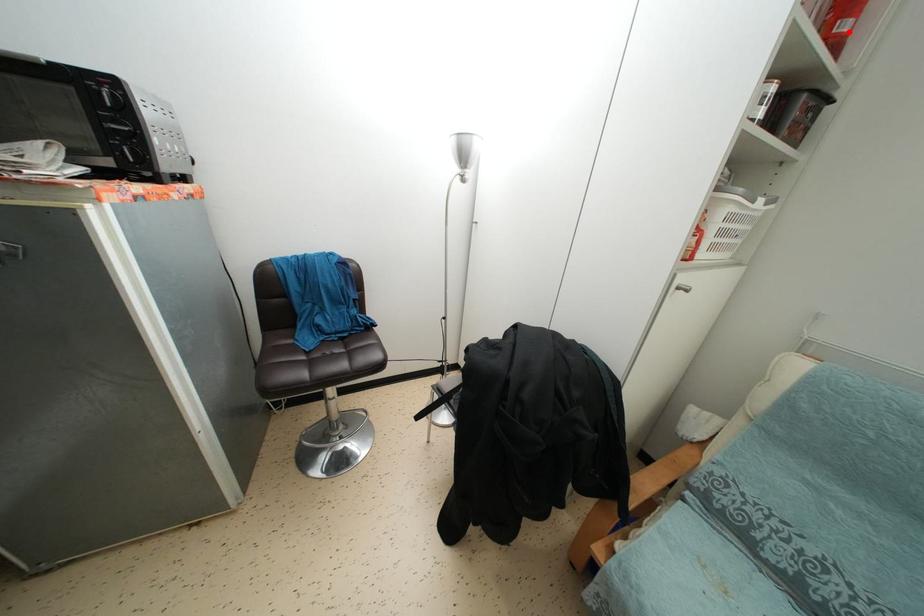
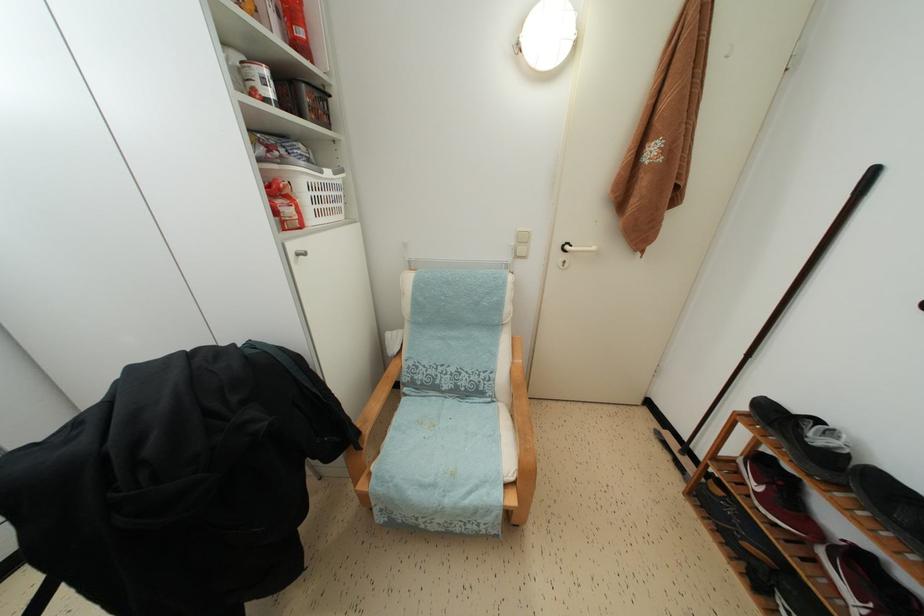
Question: I am providing you with two images of the same scene from different viewpoints. In image1, a red point is highlighted. Considering the same 3D point in image2, which of the following is correct?

Choices:
 (A) It is closer
 (B) It is farther

Answer: (A)